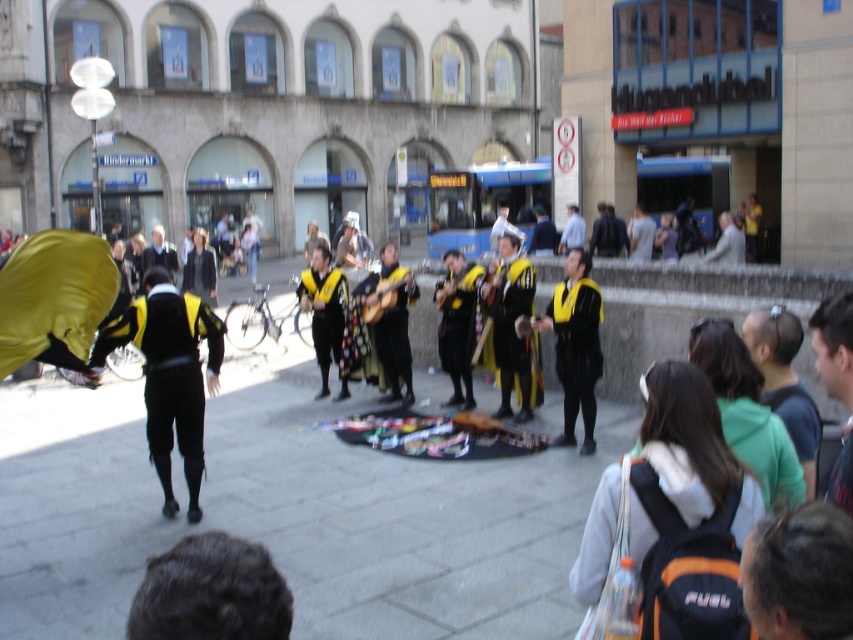
How distant is black velvet pants at left from dark blue hoodie at lower right?

A distance of 4.61 meters exists between black velvet pants at left and dark blue hoodie at lower right.

Based on the photo, who is positioned more to the left, black velvet pants at left or dark blue hoodie at lower right?

black velvet pants at left

Is point (201, 417) positioned in front of point (811, 477)?

No, it is not.

This screenshot has width=853, height=640. I want to click on black velvet pants at left, so click(x=169, y=374).

Is matte black coat at center closer to the viewer compared to light blue shirt at center?

Yes, it is in front of light blue shirt at center.

What are the coordinates of `matte black coat at center` in the screenshot? It's located at (160, 253).

The height and width of the screenshot is (640, 853). What are the coordinates of `matte black coat at center` in the screenshot? It's located at 160,253.

Based on the photo, which of these two, black velvet pants at left or light gray fabric jacket at center, stands shorter?

black velvet pants at left is shorter.

Between point (161, 513) and point (711, 256), which one is positioned behind?

The point (711, 256) is behind.

This screenshot has width=853, height=640. What are the coordinates of `black velvet pants at left` in the screenshot? It's located at (169, 374).